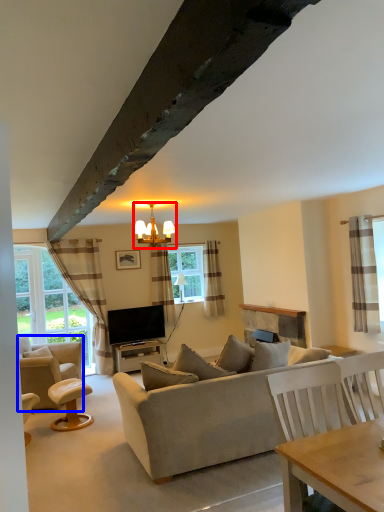
Question: Which point is closer to the camera, lamp (highlighted by a red box) or chair (highlighted by a blue box)?

Choices:
 (A) lamp
 (B) chair

Answer: (A)